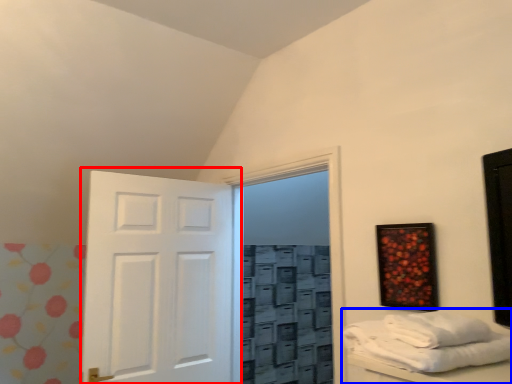
Question: Among these objects, which one is nearest to the camera, door (highlighted by a red box) or furniture (highlighted by a blue box)?

Choices:
 (A) door
 (B) furniture

Answer: (B)